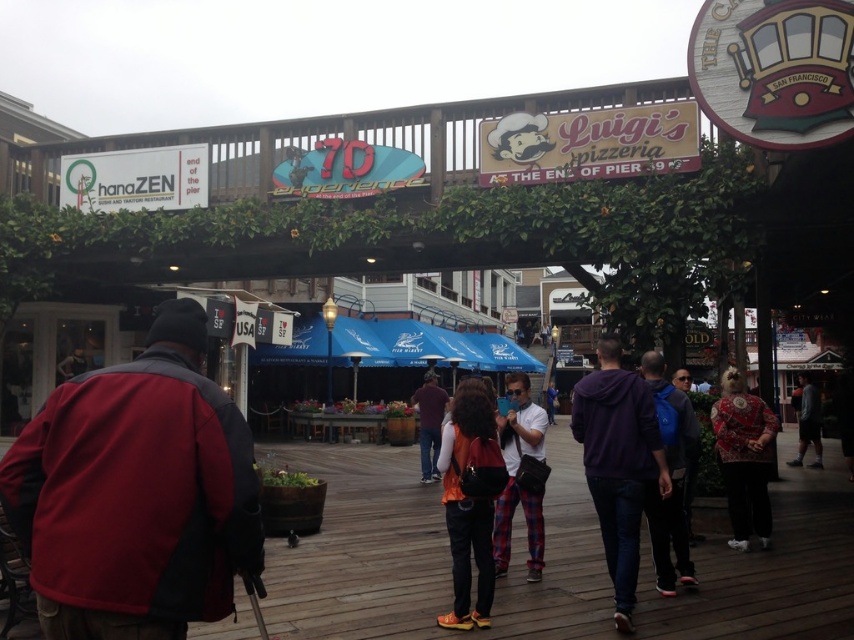
Question: Considering the real-world distances, which object is farthest from the red fleece jacket at left?

Choices:
 (A) orange fabric backpack at center
 (B) blue jeans at center
 (C) purple fleece jacket at center
 (D) patterned fabric jacket at right

Answer: (B)

Question: Is purple fleece jacket at center in front of plaid pants at center?

Choices:
 (A) no
 (B) yes

Answer: (B)

Question: Which object is the farthest from the purple fleece jacket at center?

Choices:
 (A) blue jeans at center
 (B) orange fabric backpack at center
 (C) patterned fabric jacket at right

Answer: (A)

Question: Which object appears closest to the camera in this image?

Choices:
 (A) patterned fabric jacket at right
 (B) plaid pants at center

Answer: (B)

Question: Can you confirm if purple fleece jacket at center is thinner than blue fabric canopy at center?

Choices:
 (A) no
 (B) yes

Answer: (B)

Question: Does patterned fabric jacket at right have a greater width compared to blue jeans at center?

Choices:
 (A) no
 (B) yes

Answer: (A)